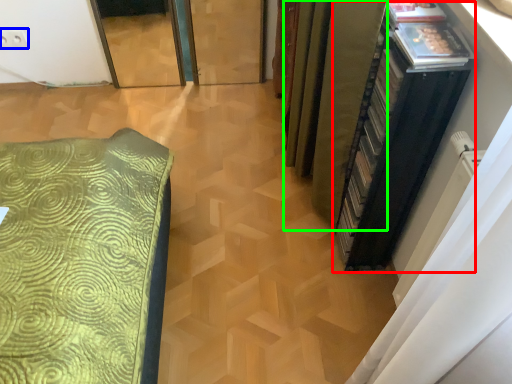
Question: Estimate the real-world distances between objects in this image. Which object is closer to file cabinet (highlighted by a red box), electric outlet (highlighted by a blue box) or curtain (highlighted by a green box)?

Choices:
 (A) electric outlet
 (B) curtain

Answer: (B)